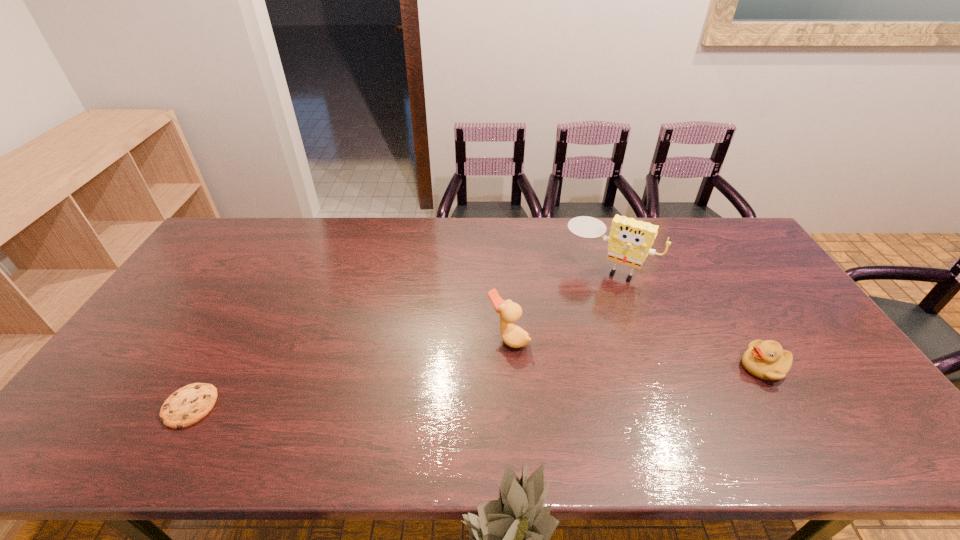
This screenshot has width=960, height=540. I want to click on vacant space that satisfies the following two spatial constraints: 1. on the back side of the duckling; 2. at the beak of the shortest object, so click(212, 367).

This screenshot has height=540, width=960. What are the coordinates of `vacant space that satisfies the following two spatial constraints: 1. on the back side of the tallest object; 2. on the left side of the duck` in the screenshot? It's located at click(503, 267).

Where is `vacant area that satisfies the following two spatial constraints: 1. on the back side of the rightmost object; 2. at the beak of the cookie`? The image size is (960, 540). vacant area that satisfies the following two spatial constraints: 1. on the back side of the rightmost object; 2. at the beak of the cookie is located at coordinates (212, 367).

At what (x,y) coordinates should I click in order to perform the action: click on free region that satisfies the following two spatial constraints: 1. on the front side of the second object from left to right; 2. at the beak of the rightmost object. Please return your answer as a coordinate pair (x, y). This screenshot has width=960, height=540. Looking at the image, I should click on (510, 367).